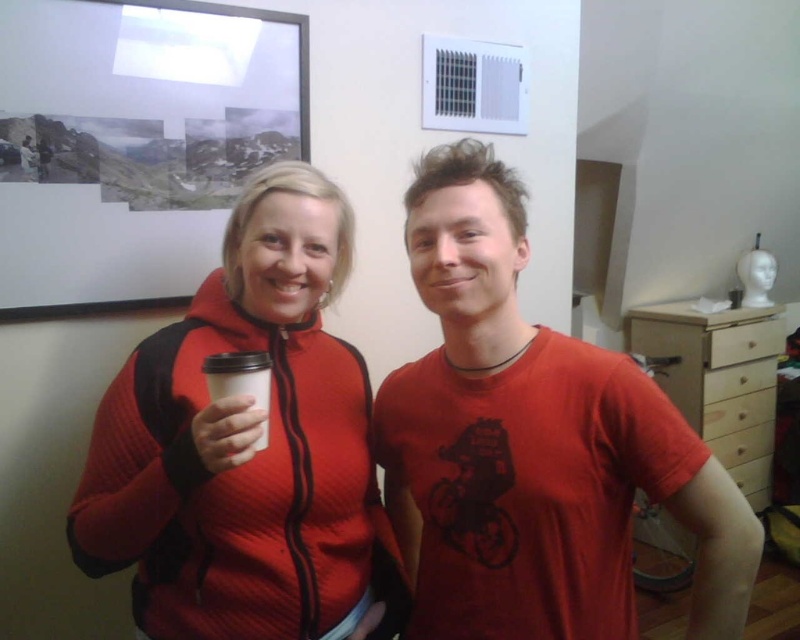
Question: Among these points, which one is farthest from the camera?

Choices:
 (A) (425, 275)
 (B) (160, 376)
 (C) (264, 364)

Answer: (B)

Question: Which object is positioned closest to the matte red jacket at center?

Choices:
 (A) matte red t-shirt at center
 (B) white paper cup at center

Answer: (B)

Question: Can you confirm if matte red t-shirt at center is positioned above white paper cup at center?

Choices:
 (A) yes
 (B) no

Answer: (B)

Question: Does matte red t-shirt at center have a lesser width compared to matte red jacket at center?

Choices:
 (A) no
 (B) yes

Answer: (A)

Question: Which point is closer to the camera?

Choices:
 (A) (218, 548)
 (B) (472, 310)

Answer: (B)

Question: Is matte red jacket at center behind white paper cup at center?

Choices:
 (A) yes
 (B) no

Answer: (B)